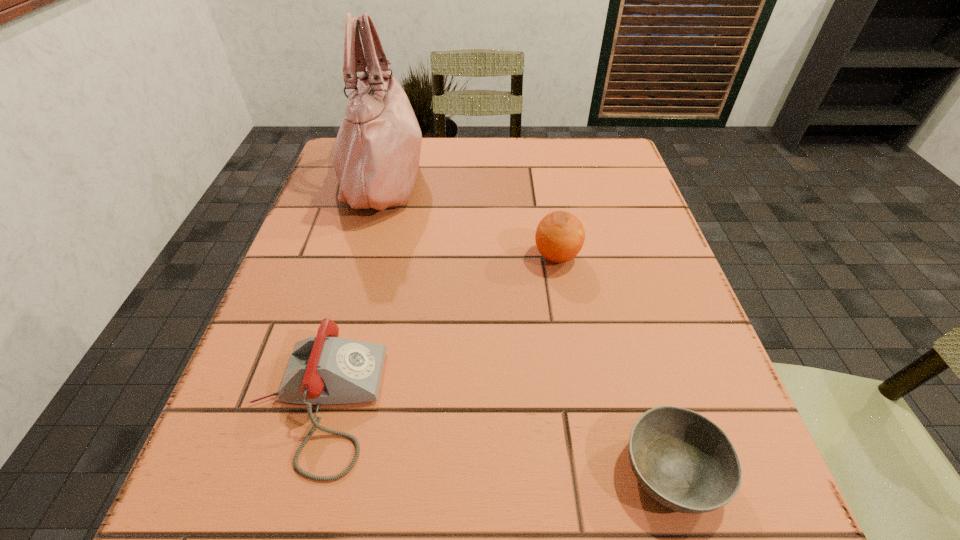
This screenshot has height=540, width=960. Identify the location of handbag. (376, 158).

Find the location of a particular element. This screenshot has height=540, width=960. the farthest object is located at coordinates (376, 158).

At what (x,y) coordinates should I click in order to perform the action: click on orange. Please return your answer as a coordinate pair (x, y). Image resolution: width=960 pixels, height=540 pixels. Looking at the image, I should click on (560, 235).

Locate an element on the screen. The height and width of the screenshot is (540, 960). the third nearest object is located at coordinates (560, 235).

This screenshot has height=540, width=960. Identify the location of the second shortest object. (323, 370).

Where is `the shortest object`? This screenshot has height=540, width=960. the shortest object is located at coordinates (683, 460).

This screenshot has width=960, height=540. I want to click on vacant space located 0.050m at the front of the tallest object with handles, so click(446, 177).

In order to click on vacant space located 0.240m on the back of the orange in this screenshot , I will do `click(542, 177)`.

This screenshot has height=540, width=960. In order to click on free spot located on the dial of the telephone in this screenshot , I will do [x=450, y=403].

Where is `vacant space located 0.190m on the back of the shortest object`? The width and height of the screenshot is (960, 540). vacant space located 0.190m on the back of the shortest object is located at coordinates (628, 322).